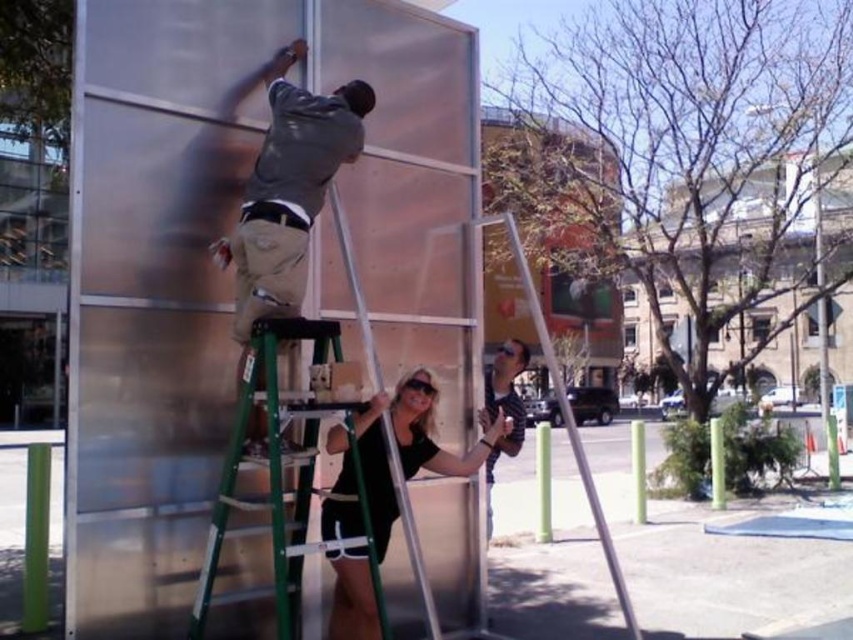
You are standing at the point with coordinates point (300,54) and want to walk to the point with coordinates point (370,508). Which direction should you move to reach your destination?

You should move forward because point (370,508) is in front of point (300,54).

What is located at the coordinates point (x=410, y=448)?

The black matte dress is located at point (x=410, y=448).

You are an observer standing in front of the installation. You notice two people wearing matte gray shirt at upper left and black matte dress at center. Which person is wider?

The black matte dress at center is wider than the matte gray shirt at upper left.